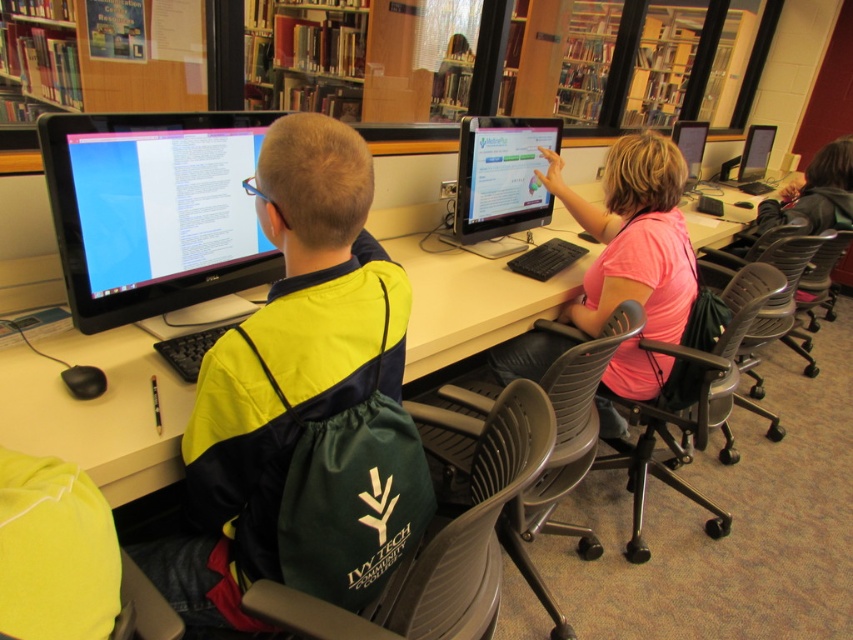
You are a person with a 12 inch wide laptop. You want to place it between the matte plastic desk at center and the pink matte shirt at center. Is there enough space?

The matte plastic desk at center is 11.16 inches away from the pink matte shirt at center, so the 12 inch wide laptop will not fit between them.